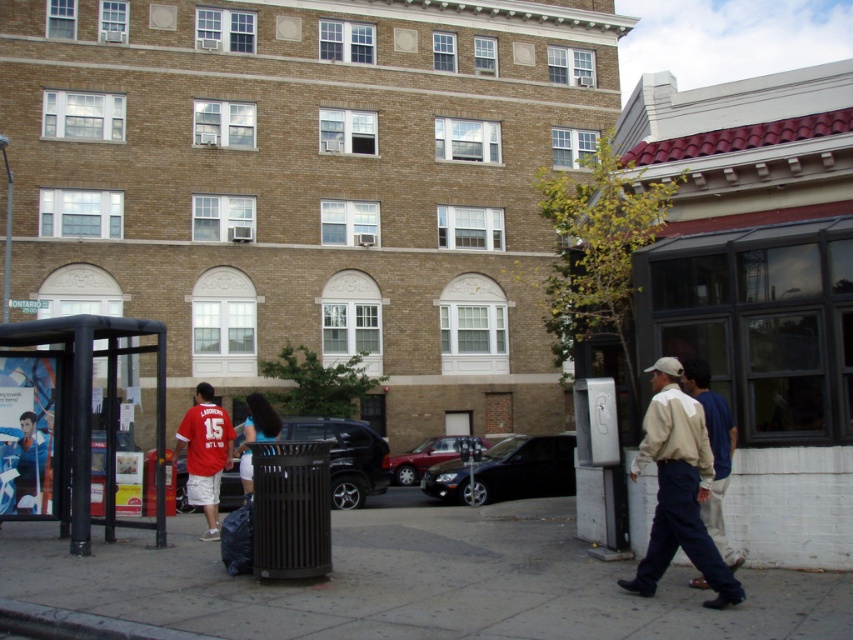
Question: Does shiny black suv at center appear on the right side of shiny red car at center?

Choices:
 (A) yes
 (B) no

Answer: (B)

Question: Which object is positioned closest to the black metal bus stop at lower left?

Choices:
 (A) black glossy car at center
 (B) red jersey at center
 (C) shiny red car at center
 (D) gray concrete sidewalk at lower center

Answer: (B)

Question: Observing the image, what is the correct spatial positioning of shiny black suv at center in reference to blue fabric shirt at center?

Choices:
 (A) right
 (B) left

Answer: (B)

Question: Estimate the real-world distances between objects in this image. Which object is farther from the light beige sweater at center?

Choices:
 (A) gray concrete sidewalk at lower center
 (B) shiny red car at center
 (C) black metal bus stop at lower left
 (D) blue fabric shirt at center

Answer: (B)

Question: From the image, what is the correct spatial relationship of white cotton shirt at center in relation to shiny red car at center?

Choices:
 (A) below
 (B) above

Answer: (B)

Question: Which of the following is the closest to the observer?

Choices:
 (A) click(x=451, y=445)
 (B) click(x=79, y=522)
 (C) click(x=700, y=364)
 (D) click(x=498, y=477)

Answer: (C)